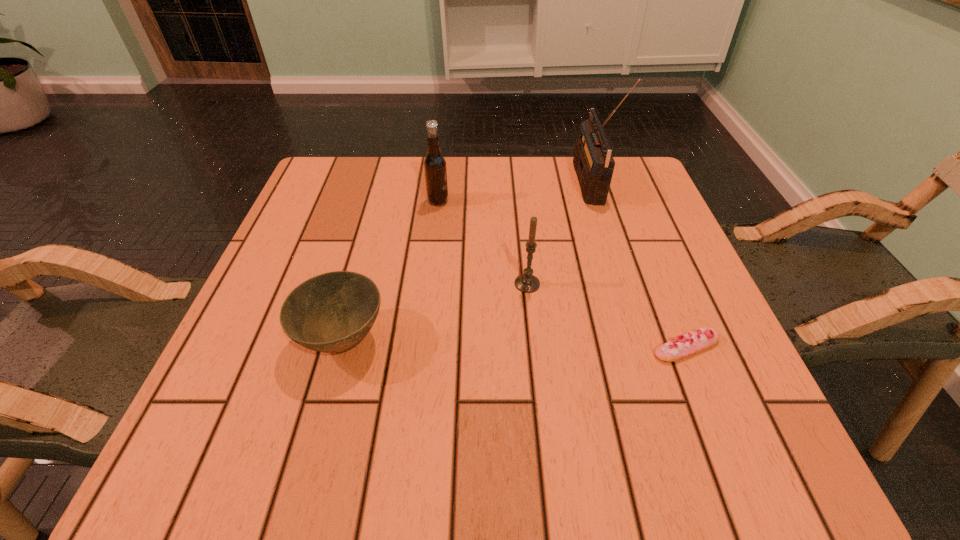
Find the location of a particular element. the tallest object is located at coordinates (593, 161).

At what (x,y) coordinates should I click in order to perform the action: click on the fourth object from right to left. Please return your answer as a coordinate pair (x, y). The height and width of the screenshot is (540, 960). Looking at the image, I should click on (435, 170).

This screenshot has height=540, width=960. Identify the location of root beer. (435, 170).

What are the coordinates of `candle` in the screenshot? It's located at (528, 283).

You are a GUI agent. You are given a task and a screenshot of the screen. Output one action in this format:
    pyautogui.click(x=<x>, y=<y>)
    Task: Click on the third tallest object
    This screenshot has width=960, height=540.
    Given the screenshot: What is the action you would take?
    pyautogui.click(x=528, y=283)

This screenshot has width=960, height=540. Find the location of `the leftmost object`. the leftmost object is located at coordinates (332, 312).

At what (x,y) coordinates should I click in order to perform the action: click on bowl. Please return your answer as a coordinate pair (x, y). The height and width of the screenshot is (540, 960). Looking at the image, I should click on click(332, 312).

At what (x,y) coordinates should I click in order to perform the action: click on eclair. Please return your answer as a coordinate pair (x, y). Looking at the image, I should click on pos(678,348).

Locate an element on the screen. This screenshot has width=960, height=540. vacant region located on the front-facing side of the radio receiver is located at coordinates (531, 184).

I want to click on vacant space located 0.340m on the front-facing side of the radio receiver, so click(x=444, y=184).